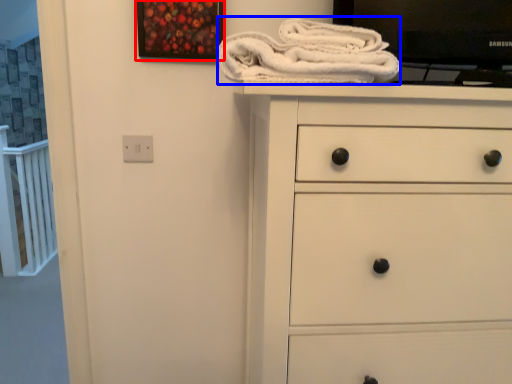
Question: Which of the following is the farthest to the observer, picture frame (highlighted by a red box) or bath towel (highlighted by a blue box)?

Choices:
 (A) picture frame
 (B) bath towel

Answer: (A)